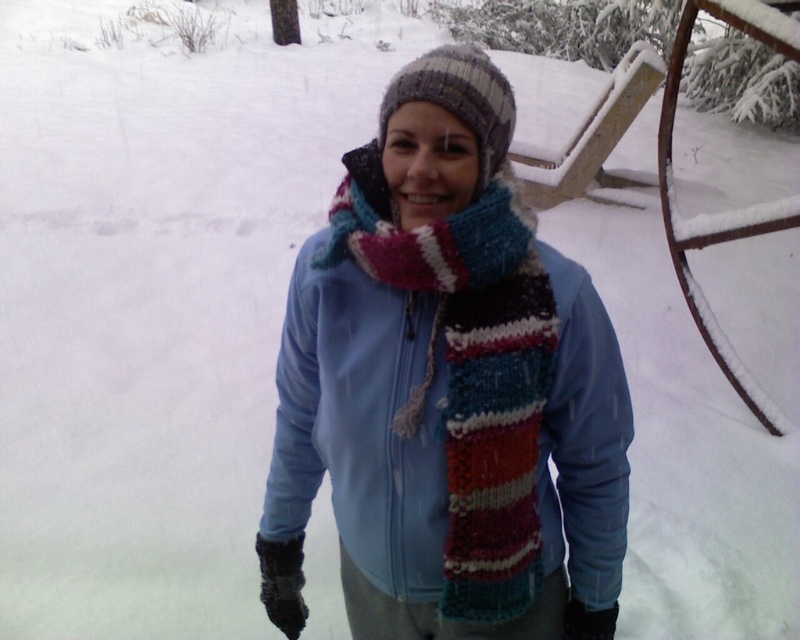
Does point (429, 365) come closer to viewer compared to point (480, 113)?

That is False.

At what (x,y) coordinates should I click in order to perform the action: click on knitted wool scarf at center. Please return your answer as a coordinate pair (x, y). Looking at the image, I should click on (470, 371).

Locate an element on the screen. The image size is (800, 640). knitted wool scarf at center is located at coordinates (470, 371).